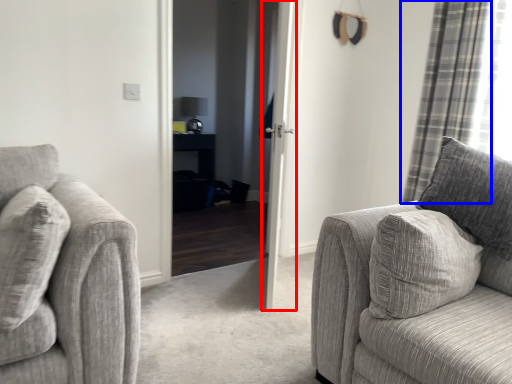
Question: Among these objects, which one is farthest to the camera, door (highlighted by a red box) or curtain (highlighted by a blue box)?

Choices:
 (A) door
 (B) curtain

Answer: (B)